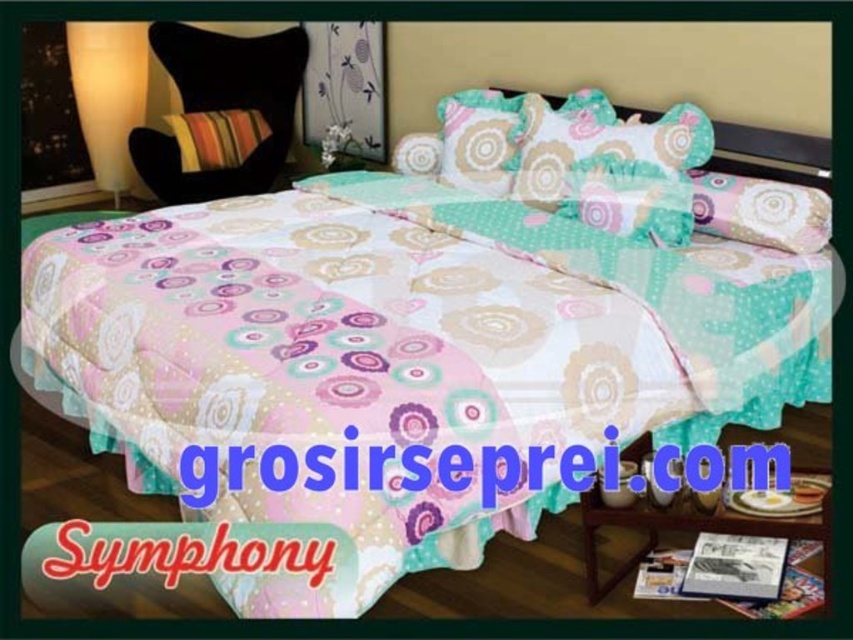
Question: Estimate the real-world distances between objects in this image. Which object is closer to the white frosted glass lamp at upper left?

Choices:
 (A) pastel floral pillow at center
 (B) striped fabric pillow at upper left
 (C) pink fabric pillow at upper right

Answer: (B)

Question: Can you confirm if pastel floral pillow at center is smaller than pink fabric pillow at upper right?

Choices:
 (A) yes
 (B) no

Answer: (A)

Question: In this image, where is pastel floral pillow at center located relative to pink fabric pillow at upper right?

Choices:
 (A) above
 (B) below

Answer: (A)

Question: Which of the following is the farthest from the observer?

Choices:
 (A) (108, 99)
 (B) (815, 243)
 (C) (218, 157)

Answer: (A)

Question: Is the position of white frosted glass lamp at upper left less distant than that of pastel floral pillow at center?

Choices:
 (A) yes
 (B) no

Answer: (B)

Question: Which point is closer to the camera?

Choices:
 (A) pink fabric pillow at upper right
 (B) pastel floral pillow at center

Answer: (A)